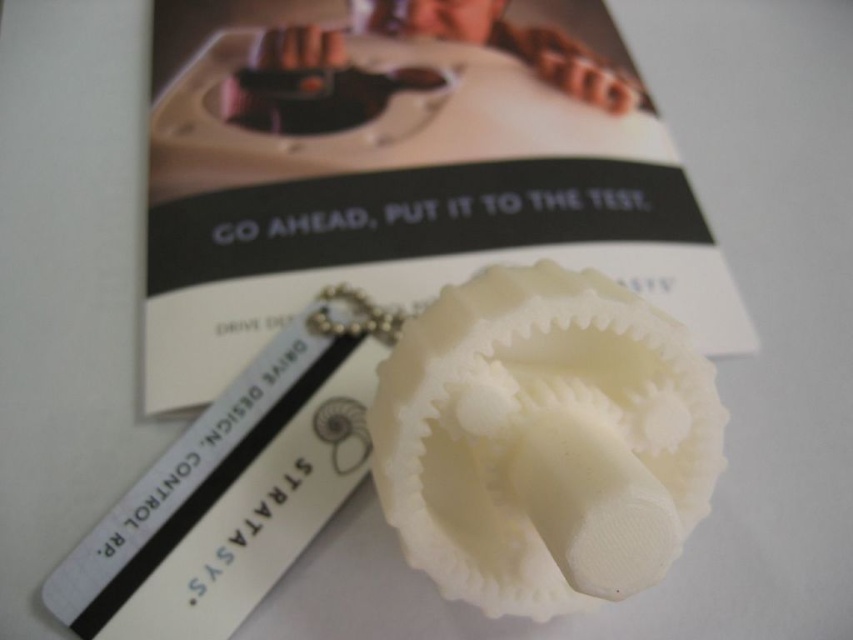
You are organizing a collection of office supplies and notice the white matte gear at center and the white plastic bookmark at center on a desk. Which object is positioned higher up when viewed from the front?

The white matte gear at center is located above the white plastic bookmark at center, so it is positioned higher up.

You are an engineer examining the keychain and need to identify the position of the white matte gear at center. What are its coordinates?

The white matte gear at center is located at point coordinates (402, 170).

In the scene shown: You are a designer who wants to attach both the white matte gear at center and the white plastic bookmark at center to a presentation board. The board has a maximum width of 10 inches. Can you fit both items on the board without overlapping them?

The white matte gear at center and the white plastic bookmark at center are 10.12 inches apart, which exceeds the board width of 10 inches. Therefore, they cannot be placed side by side without overlapping.